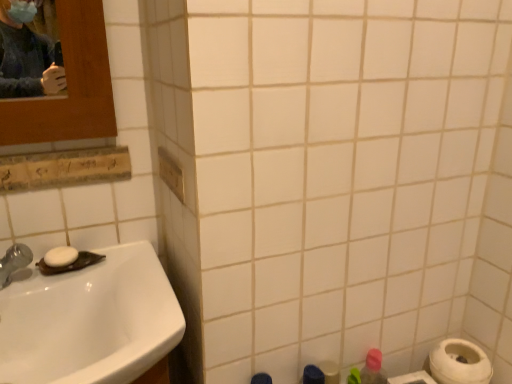
Question: Is white matte toilet paper at lower right not near white matte soap at sink left?

Choices:
 (A) yes
 (B) no

Answer: (B)

Question: From the image's perspective, does white matte toilet paper at lower right appear lower than white matte soap at sink left?

Choices:
 (A) yes
 (B) no

Answer: (A)

Question: From a real-world perspective, is white matte toilet paper at lower right over white matte soap at sink left?

Choices:
 (A) yes
 (B) no

Answer: (B)

Question: Is white matte toilet paper at lower right to the left of white matte soap at sink left from the viewer's perspective?

Choices:
 (A) yes
 (B) no

Answer: (B)

Question: Is white matte toilet paper at lower right surrounding white matte soap at sink left?

Choices:
 (A) yes
 (B) no

Answer: (B)

Question: Could you tell me if white matte toilet paper at lower right is facing white matte soap at sink left?

Choices:
 (A) no
 (B) yes

Answer: (A)

Question: Is white matte toilet paper at lower right wider than white glossy sink at lower left?

Choices:
 (A) yes
 (B) no

Answer: (B)

Question: From the image's perspective, does white matte toilet paper at lower right appear higher than white glossy sink at lower left?

Choices:
 (A) yes
 (B) no

Answer: (B)

Question: Does white matte toilet paper at lower right have a greater height compared to white glossy sink at lower left?

Choices:
 (A) no
 (B) yes

Answer: (A)

Question: Would you say white matte toilet paper at lower right is outside white glossy sink at lower left?

Choices:
 (A) yes
 (B) no

Answer: (A)

Question: Is white matte toilet paper at lower right with white glossy sink at lower left?

Choices:
 (A) yes
 (B) no

Answer: (B)

Question: Could you tell me if white matte toilet paper at lower right is turned towards white glossy sink at lower left?

Choices:
 (A) yes
 (B) no

Answer: (B)

Question: Considering the relative positions of white matte toilet paper at lower right and pink matte bottle at lower right in the image provided, is white matte toilet paper at lower right to the right of pink matte bottle at lower right from the viewer's perspective?

Choices:
 (A) yes
 (B) no

Answer: (A)